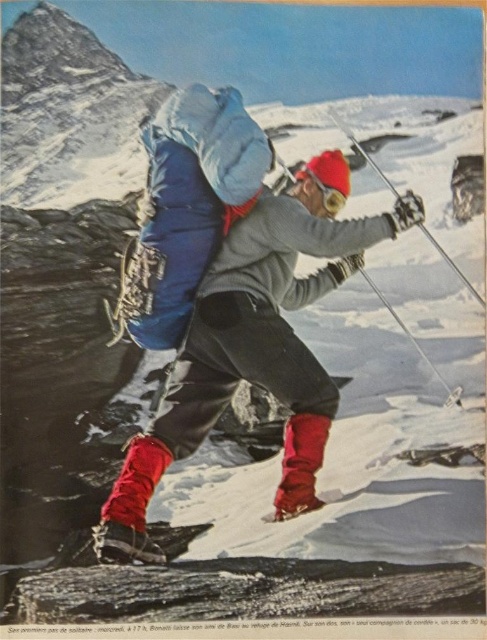
The height and width of the screenshot is (640, 487). Describe the element at coordinates (254, 346) in the screenshot. I see `matte blue backpack at center` at that location.

Who is more forward, (336,404) or (443,252)?

Point (336,404)

Identify the location of matte blue backpack at center. The image size is (487, 640). (x=254, y=346).